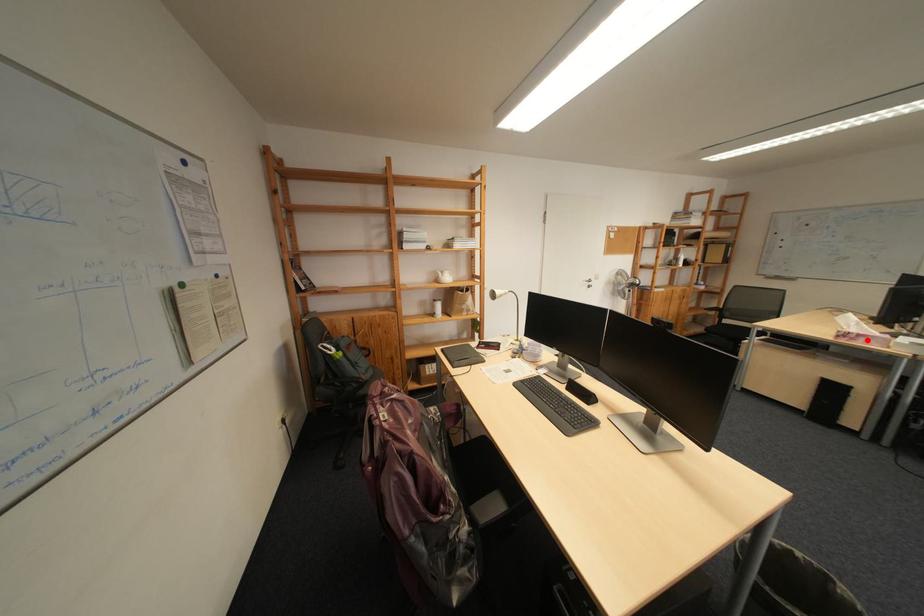
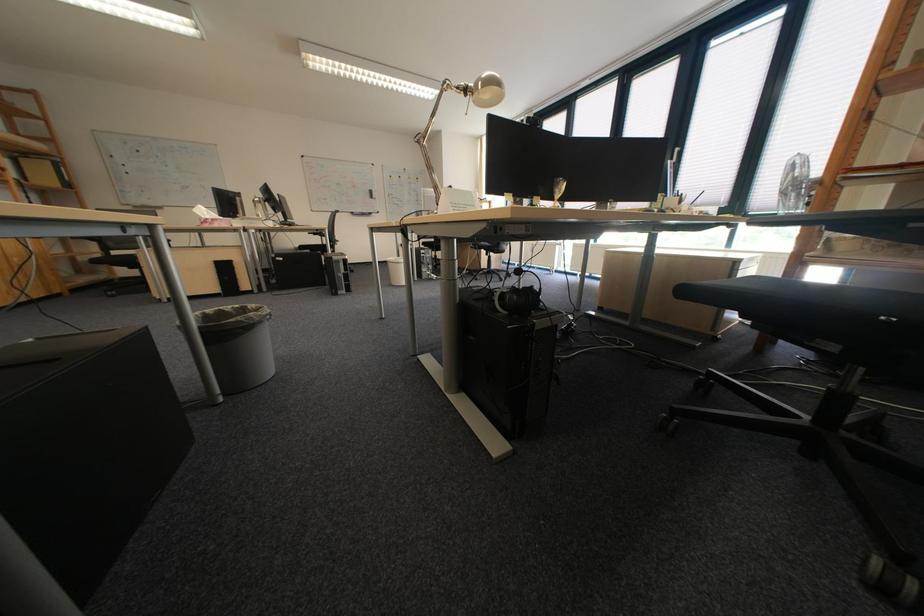
Question: I am providing you with two images of the same scene from different viewpoints. In image1, a red point is highlighted. Considering the same 3D point in image2, which of the following is correct?

Choices:
 (A) It is closer
 (B) It is farther

Answer: (A)